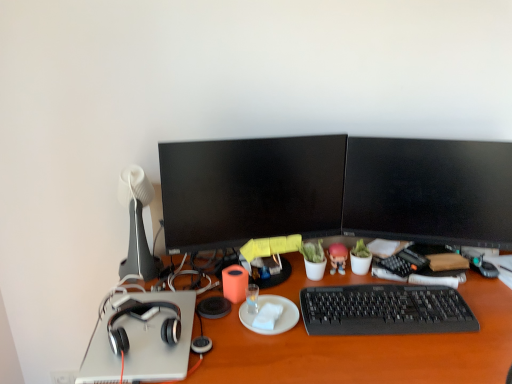
Question: Which is correct: white matte plate at center is inside black matte headphones at left, or outside of it?

Choices:
 (A) inside
 (B) outside

Answer: (B)

Question: In terms of width, does white matte plate at center look wider or thinner when compared to black matte headphones at left?

Choices:
 (A) thin
 (B) wide

Answer: (A)

Question: Which of these objects is positioned farthest from the orange matte cup at center?

Choices:
 (A) black matte keyboard at lower right
 (B) pink glossy figurine at center
 (C) white matte notepad at center
 (D) white matte lamp at left
 (E) black matte headphones at left

Answer: (A)

Question: Based on their relative distances, which object is farther from the black matte headphones at left?

Choices:
 (A) black glossy monitor at center, the second television when ordered from right to left
 (B) white matte plate at center
 (C) pink glossy figurine at center
 (D) white matte notepad at center
 (E) orange matte cup at center

Answer: (C)